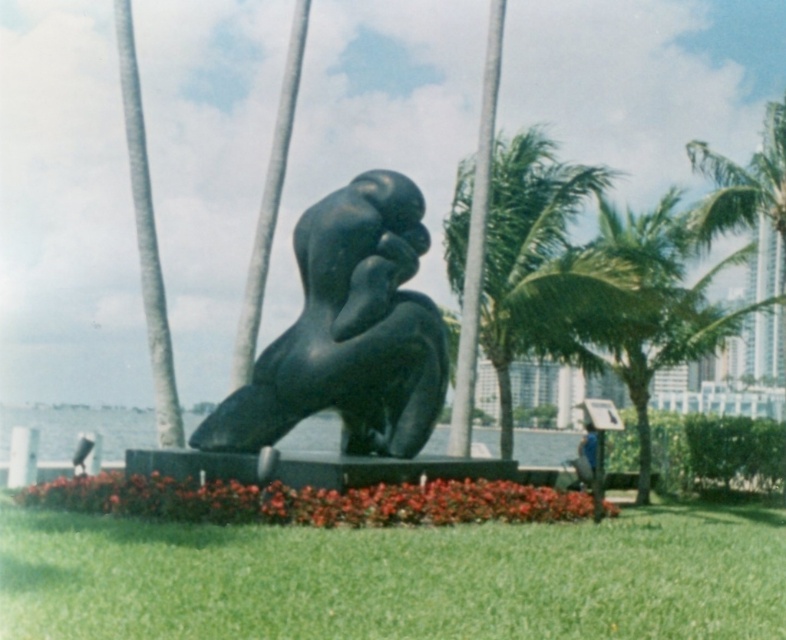
Question: Is green leafy palm tree at center thinner than blue jeans at center?

Choices:
 (A) no
 (B) yes

Answer: (A)

Question: Among these points, which one is nearest to the camera?

Choices:
 (A) (373, 417)
 (B) (469, 300)
 (C) (57, 524)

Answer: (C)

Question: Is green grass at center below green leafy palm tree at right?

Choices:
 (A) yes
 (B) no

Answer: (A)

Question: Among these objects, which one is farthest from the camera?

Choices:
 (A) green leafy palm tree at right
 (B) black polished statue at center

Answer: (A)

Question: Observing the image, what is the correct spatial positioning of green leafy palm tree at center in reference to blue jeans at center?

Choices:
 (A) below
 (B) above

Answer: (B)

Question: Which is farther from the smooth gray tree at center?

Choices:
 (A) smooth gray pole at center
 (B) blue jeans at center
 (C) green leafy palm tree at right
 (D) green grass at center

Answer: (C)